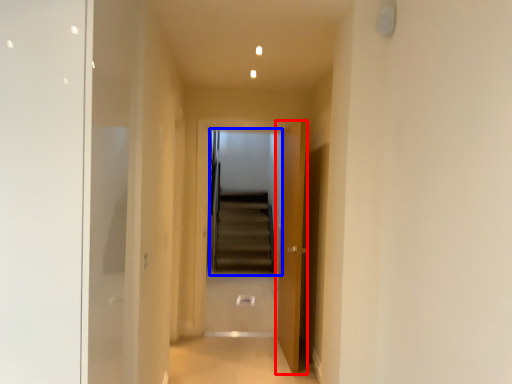
Question: Which of the following is the closest to the observer, door (highlighted by a red box) or escalator (highlighted by a blue box)?

Choices:
 (A) door
 (B) escalator

Answer: (A)